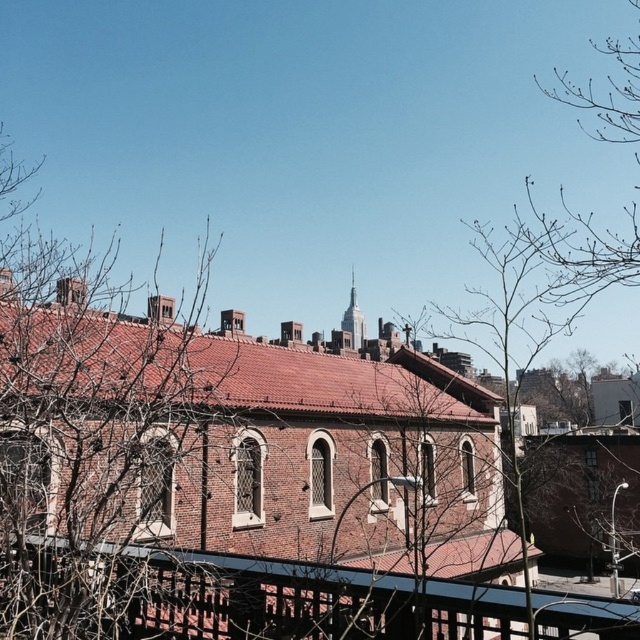
Question: Where is brown wooden rail at center located in relation to smooth glass spire at upper center in the image?

Choices:
 (A) above
 (B) below

Answer: (B)

Question: Where is brown wooden rail at center located in relation to smooth glass spire at upper center in the image?

Choices:
 (A) above
 (B) below

Answer: (B)

Question: Does bare branches at left have a greater width compared to brown wooden rail at center?

Choices:
 (A) no
 (B) yes

Answer: (B)

Question: Which object appears closest to the camera in this image?

Choices:
 (A) brown wooden rail at center
 (B) bare branches at left
 (C) smooth glass spire at upper center

Answer: (B)

Question: Considering the real-world distances, which object is closest to the bare branches at left?

Choices:
 (A) smooth glass spire at upper center
 (B) brown wooden rail at center

Answer: (B)

Question: Estimate the real-world distances between objects in this image. Which object is closer to the bare branches at left?

Choices:
 (A) smooth glass spire at upper center
 (B) brown wooden rail at center

Answer: (B)